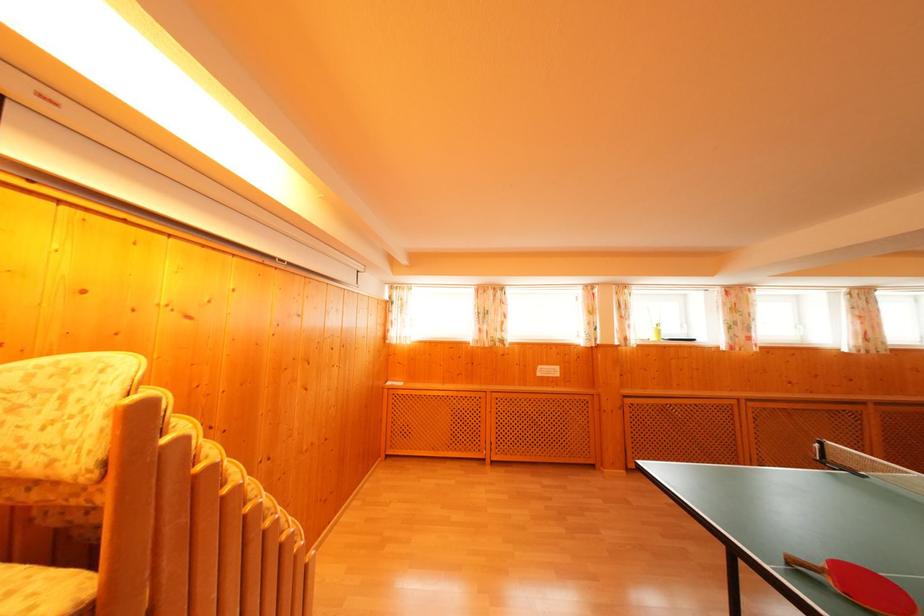
What do you see at coordinates (818, 451) in the screenshot?
I see `the projector screen handle` at bounding box center [818, 451].